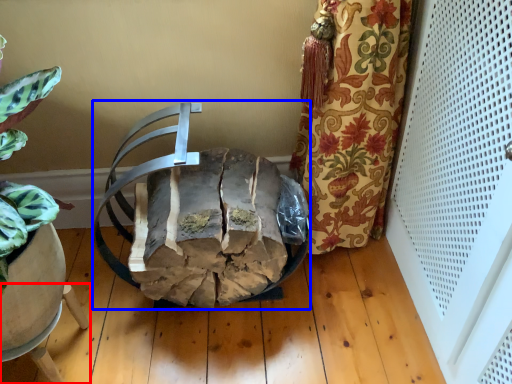
Question: Which point is further to the camera, furniture (highlighted by a red box) or chair (highlighted by a blue box)?

Choices:
 (A) furniture
 (B) chair

Answer: (A)